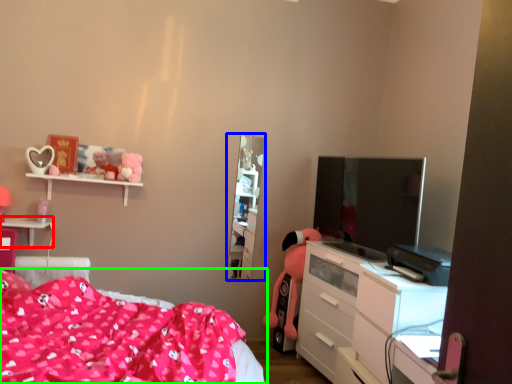
Question: Based on their relative distances, which object is nearer to table (highlighted by a red box)? Choose from tv cabinet (highlighted by a blue box) and bed (highlighted by a green box).

Choices:
 (A) tv cabinet
 (B) bed

Answer: (B)